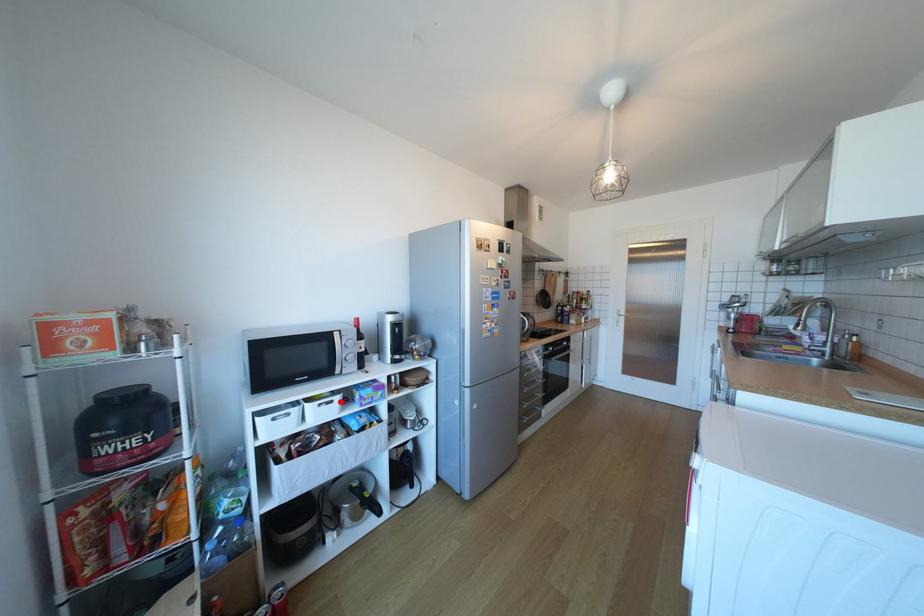
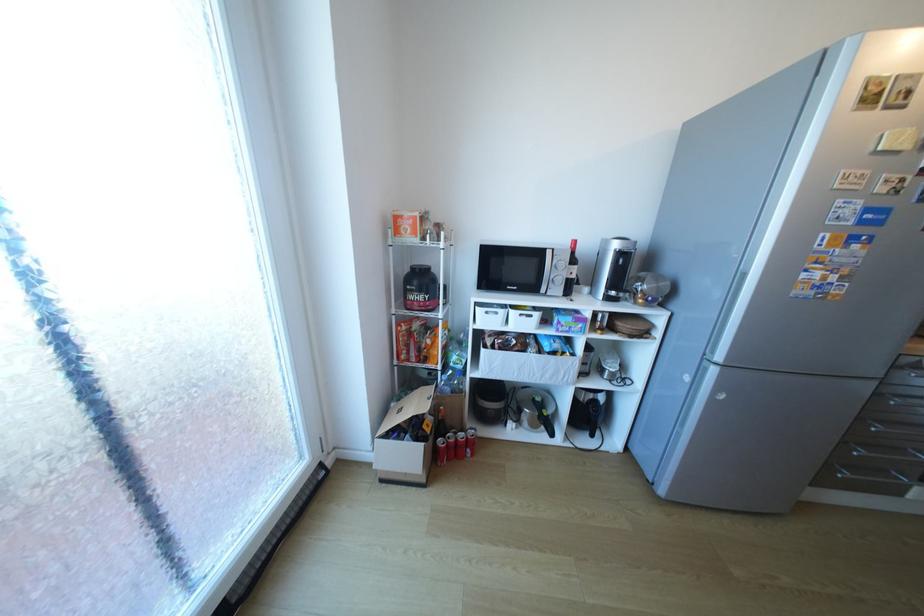
Question: I am providing you with two images of the same scene from different viewpoints. A red point is marked on the first image. Can you still see the location of the red point in image 2?

Choices:
 (A) Yes
 (B) No

Answer: (A)